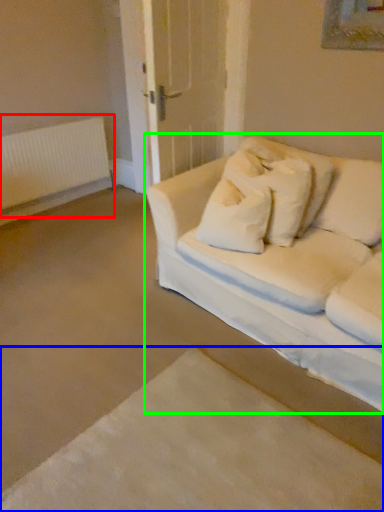
Question: Considering the real-world distances, which object is closest to radiator (highlighted by a red box)? bed frame (highlighted by a blue box) or studio couch (highlighted by a green box).

Choices:
 (A) bed frame
 (B) studio couch

Answer: (B)